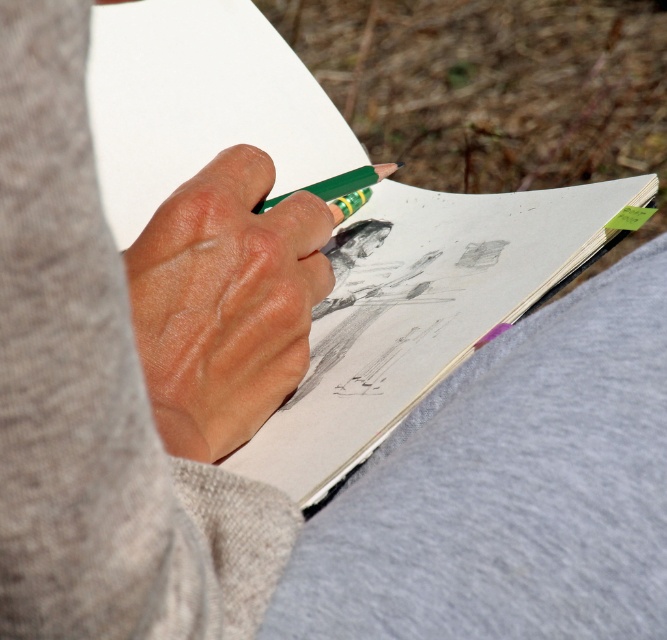
You are an art student who needs to know which object is taller between the white paper at center and the green matte pencil at center. Can you tell me which one is taller?

The white paper at center is taller than the green matte pencil at center.

You are a photographer adjusting your camera focus. You notice two points in the scene labeled as point (9, 252) and point (143, 3). Which point should you focus on first if you want to capture the closest object in sharp detail?

Point (9, 252) is closer to the camera than point (143, 3), so you should focus on point (9, 252) first to capture the closest object in sharp detail.